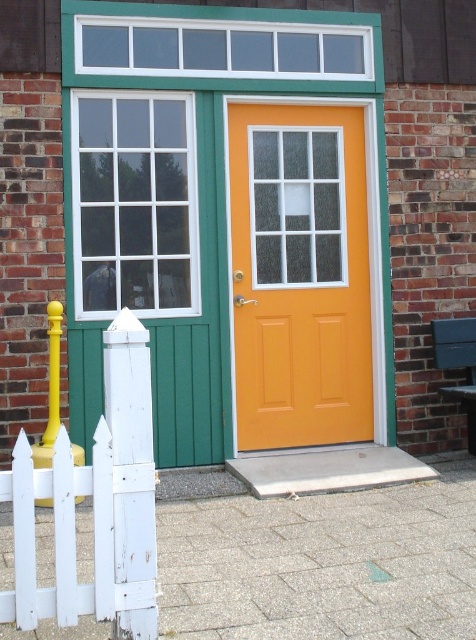
Question: Which point appears farthest from the camera in this image?

Choices:
 (A) (307, 269)
 (B) (50, 600)

Answer: (A)

Question: Which object appears closest to the camera in this image?

Choices:
 (A) white wooden picket fence at left
 (B) orange matte door at center

Answer: (A)

Question: Can you confirm if orange matte door at center is positioned to the left of white wooden picket fence at left?

Choices:
 (A) no
 (B) yes

Answer: (A)

Question: Does orange matte door at center appear over white wooden picket fence at left?

Choices:
 (A) no
 (B) yes

Answer: (B)

Question: Is orange matte door at center to the right of white wooden picket fence at left from the viewer's perspective?

Choices:
 (A) yes
 (B) no

Answer: (A)